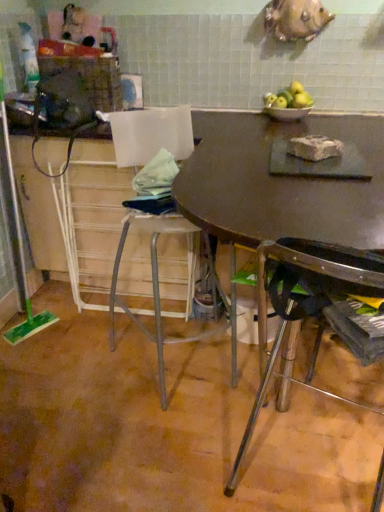
This screenshot has width=384, height=512. In order to click on free space in front of green plastic screen door at left in this screenshot , I will do `click(24, 321)`.